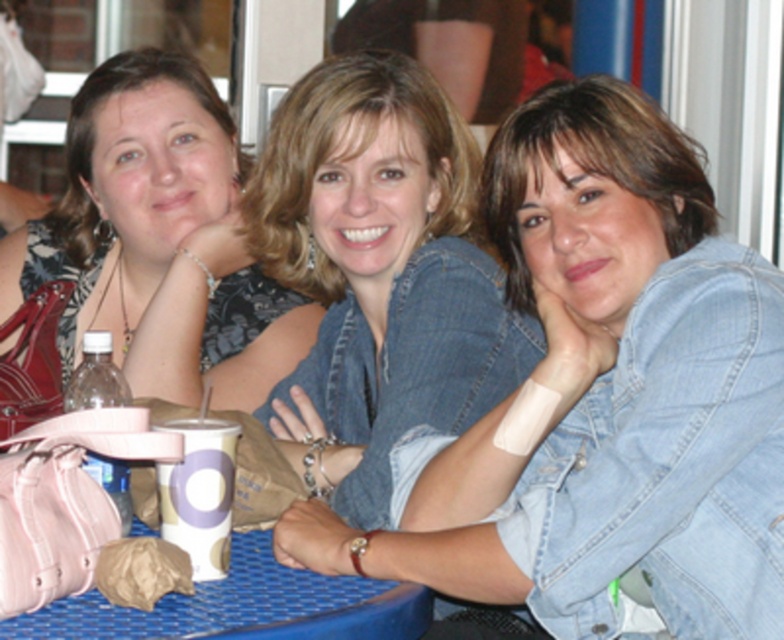
Question: Can you confirm if faded denim jacket at lower right is positioned below matte black dress at upper left?

Choices:
 (A) no
 (B) yes

Answer: (B)

Question: Which of the following is the farthest from the observer?

Choices:
 (A) matte black dress at upper left
 (B) denim jacket at center

Answer: (A)

Question: In this image, where is faded denim jacket at lower right located relative to denim jacket at center?

Choices:
 (A) right
 (B) left

Answer: (A)

Question: Which object is positioned closest to the faded denim jacket at lower right?

Choices:
 (A) matte black dress at upper left
 (B) denim jacket at center

Answer: (B)

Question: Which point is closer to the camera?

Choices:
 (A) denim jacket at center
 (B) faded denim jacket at lower right
 (C) matte black dress at upper left

Answer: (B)

Question: Does faded denim jacket at lower right appear under matte black dress at upper left?

Choices:
 (A) yes
 (B) no

Answer: (A)